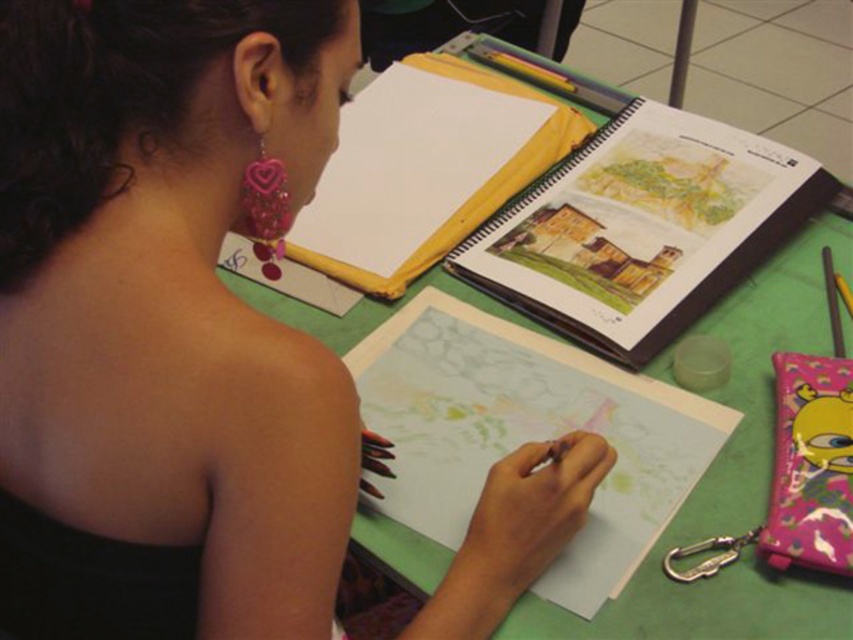
You are standing in front of the table where the person is drawing. Where exactly is the matte black dress at center located on the table?

The matte black dress at center is located at point coordinates of 0.503 on the x axis and 0.195 on the y axis.

You are a fashion designer who wants to place a new accessory on the table. The accessory is 10 inches wide. Based on the distance between the matte black dress at center and the green matte table at center, will the accessory fit between them without overlapping?

The distance between the matte black dress at center and the green matte table at center is 9.44 inches. Since the accessory is 10 inches wide, it will not fit between them without overlapping as the space is narrower than the accessory.

You are a fashion designer observing the scene. You need to place a new accessory on the table without overlapping the existing objects. Given the sizes of the matte black dress at center and green matte table at center, can you fit the accessory on the table?

The matte black dress at center occupies less space than the green matte table at center, so there is enough space on the green matte table at center to place the accessory without overlapping existing objects.